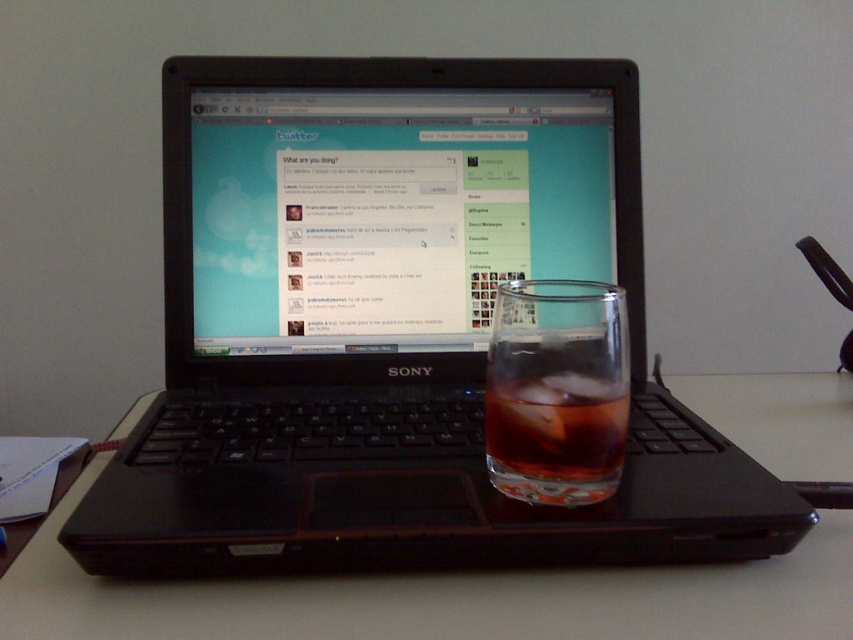
Question: Which of the following is the farthest from the observer?

Choices:
 (A) (445, 625)
 (B) (616, 387)
 (C) (601, 138)

Answer: (C)

Question: Considering the relative positions of black plastic laptop at center and transparent glass at center in the image provided, where is black plastic laptop at center located with respect to transparent glass at center?

Choices:
 (A) left
 (B) right

Answer: (A)

Question: Is black plastic laptop at center smaller than translucent glass at laptop right?

Choices:
 (A) no
 (B) yes

Answer: (A)

Question: Which of these objects is positioned closest to the translucent glass at laptop right?

Choices:
 (A) transparent glass at center
 (B) black plastic laptop at center

Answer: (B)

Question: Which object is positioned closest to the black plastic laptop at center?

Choices:
 (A) transparent glass at center
 (B) translucent glass at laptop right

Answer: (B)

Question: Does black plastic laptop at center come behind translucent glass at laptop right?

Choices:
 (A) yes
 (B) no

Answer: (B)